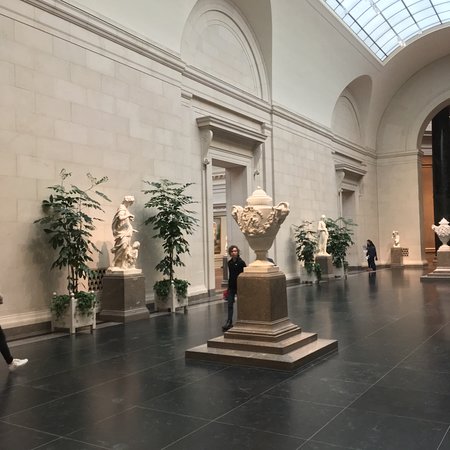
This screenshot has width=450, height=450. In order to click on planter in this screenshot , I will do `click(75, 311)`, `click(171, 293)`, `click(311, 270)`, `click(341, 265)`.